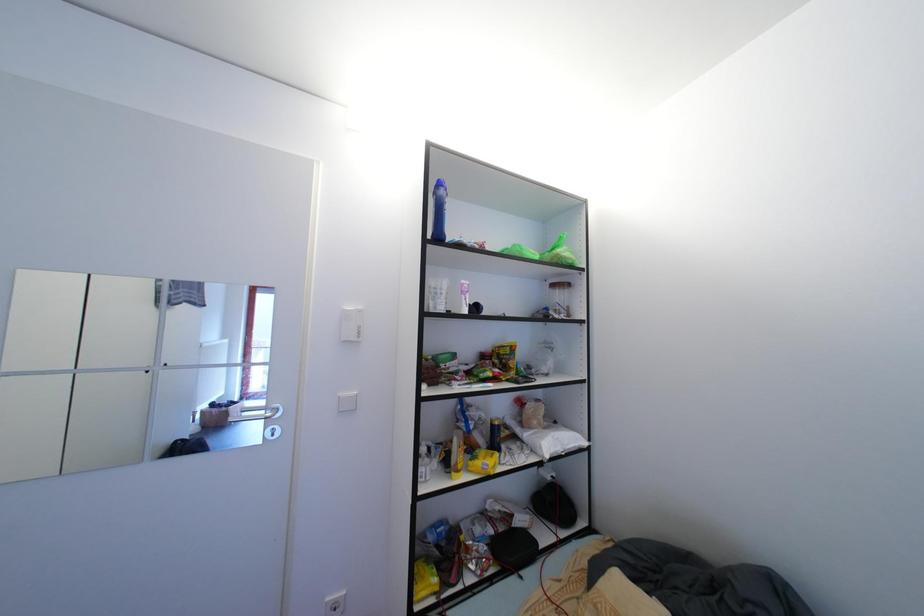
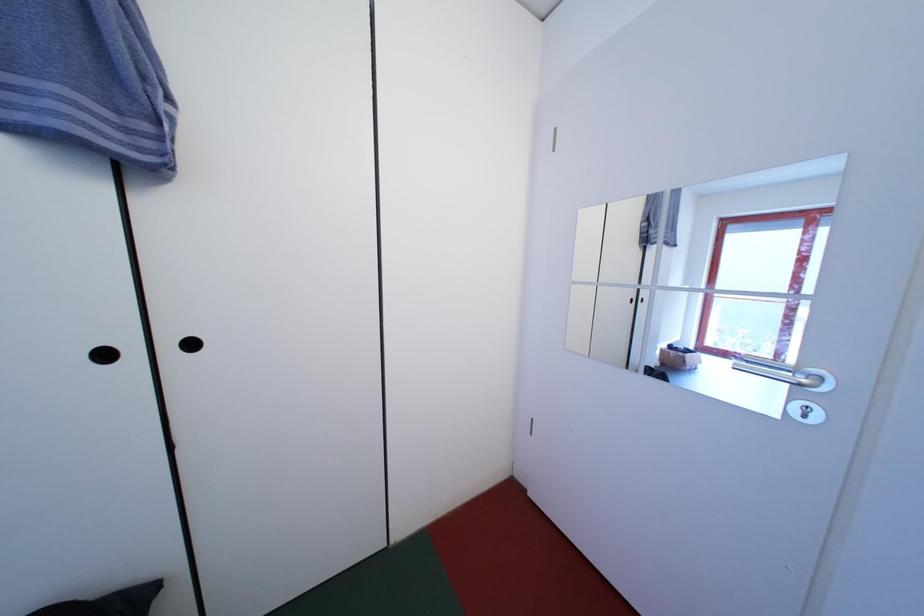
Question: The camera is either moving clockwise (left) or counter-clockwise (right) around the object. The first image is from the beginning of the video and the second image is from the end. Is the camera moving left or right when shooting the video?

Choices:
 (A) Left
 (B) Right

Answer: (B)